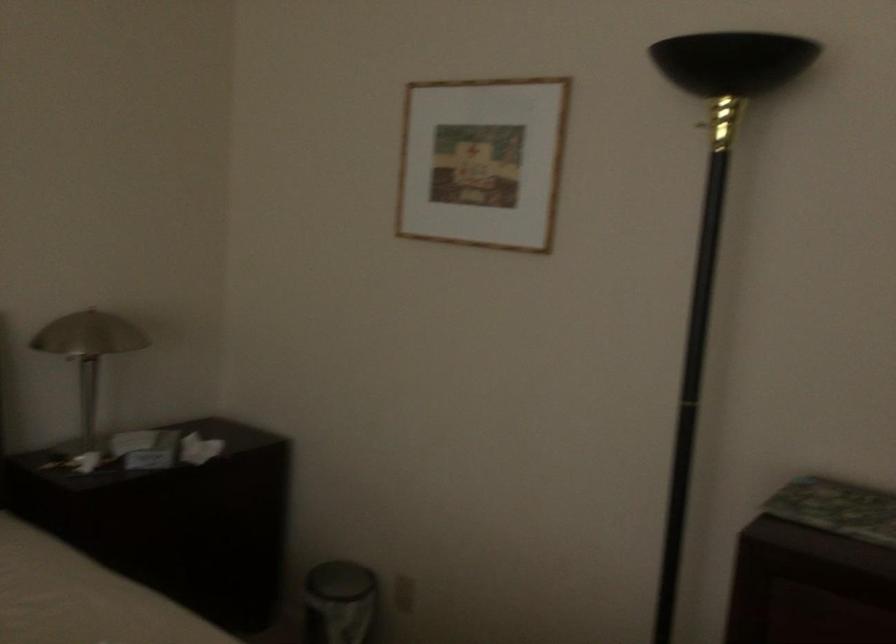
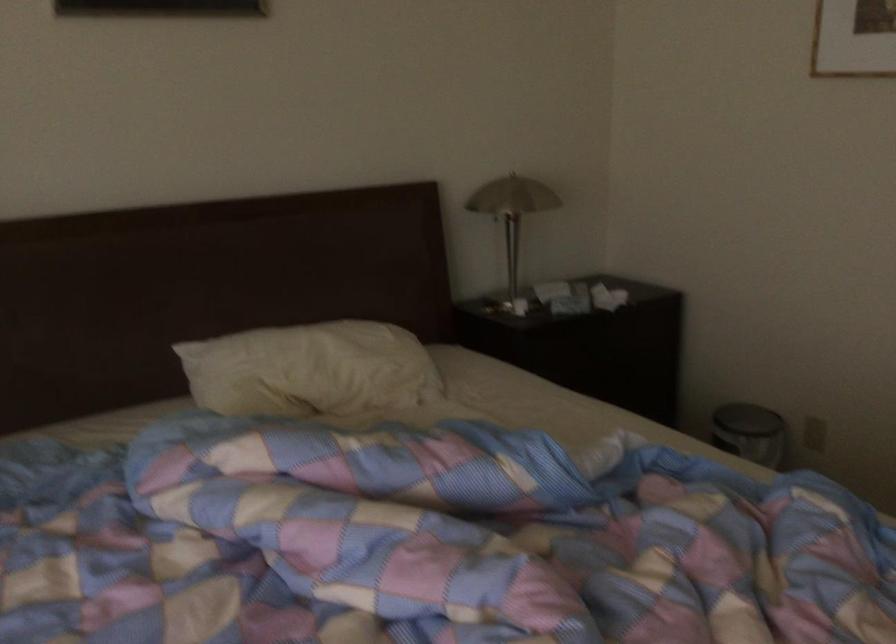
Question: The camera is either moving clockwise (left) or counter-clockwise (right) around the object. The first image is from the beginning of the video and the second image is from the end. Is the camera moving left or right when shooting the video?

Choices:
 (A) Left
 (B) Right

Answer: (B)